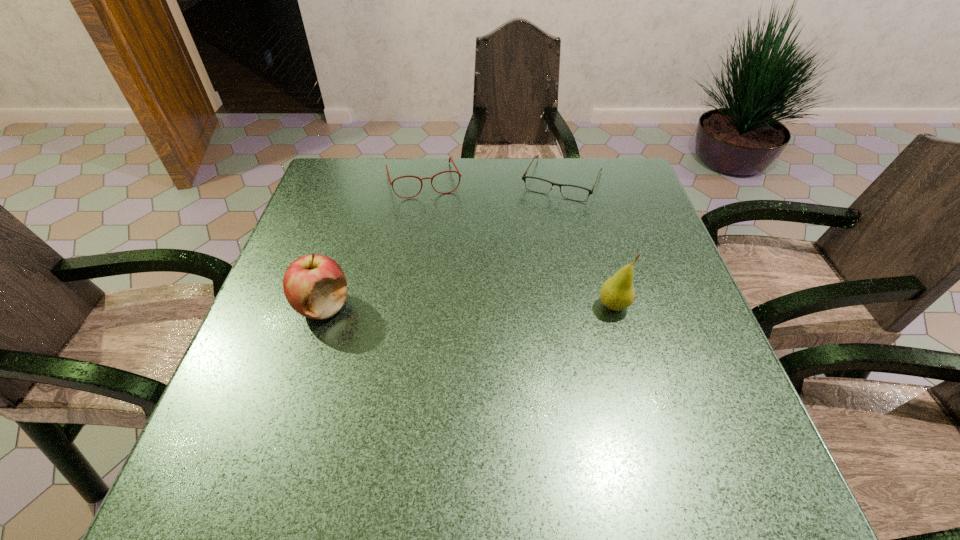
At what (x,y) coordinates should I click in order to perform the action: click on free space on the desktop that is between the apple and the pear and is positioned on the face of the taller spectacles. Please return your answer as a coordinate pair (x, y). This screenshot has height=540, width=960. Looking at the image, I should click on (456, 306).

Identify the location of vacant space on the desktop that is between the apple and the pear and is positioned on the front-facing side of the right spectacles. The image size is (960, 540). (506, 306).